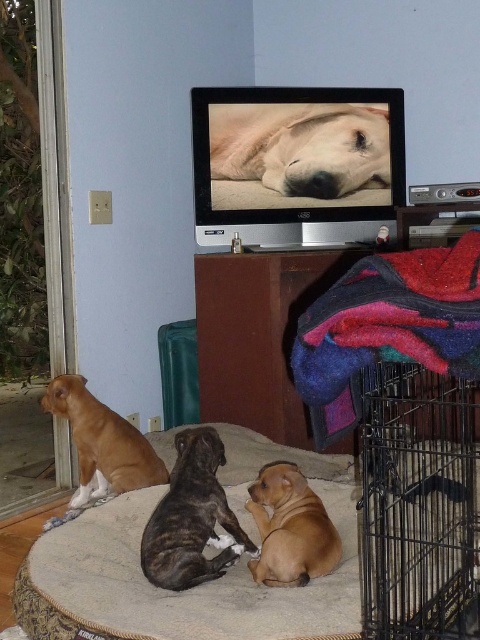
Which is below, golden fur dog at center or matte brown dog at center?

Positioned lower is matte brown dog at center.

What do you see at coordinates (300, 147) in the screenshot? This screenshot has height=640, width=480. I see `golden fur dog at center` at bounding box center [300, 147].

The image size is (480, 640). Find the location of `golden fur dog at center`. golden fur dog at center is located at coordinates (300, 147).

Can you confirm if golden fur dog at center is positioned above matte brown dog at left?

Correct, golden fur dog at center is located above matte brown dog at left.

Does golden fur dog at center have a lesser width compared to matte brown dog at left?

No, golden fur dog at center is not thinner than matte brown dog at left.

Between point (273, 168) and point (142, 477), which one is positioned behind?

Point (273, 168)

Locate an element on the screen. golden fur dog at center is located at coordinates (300, 147).

Consider the image. Who is taller, black wire cage at lower right or brindle fur dog at center?

black wire cage at lower right is taller.

Between black wire cage at lower right and brindle fur dog at center, which one appears on the left side from the viewer's perspective?

brindle fur dog at center

Is point (410, 584) positioned in front of point (154, 529)?

Yes, point (410, 584) is in front of point (154, 529).

The image size is (480, 640). I want to click on black wire cage at lower right, so click(419, 504).